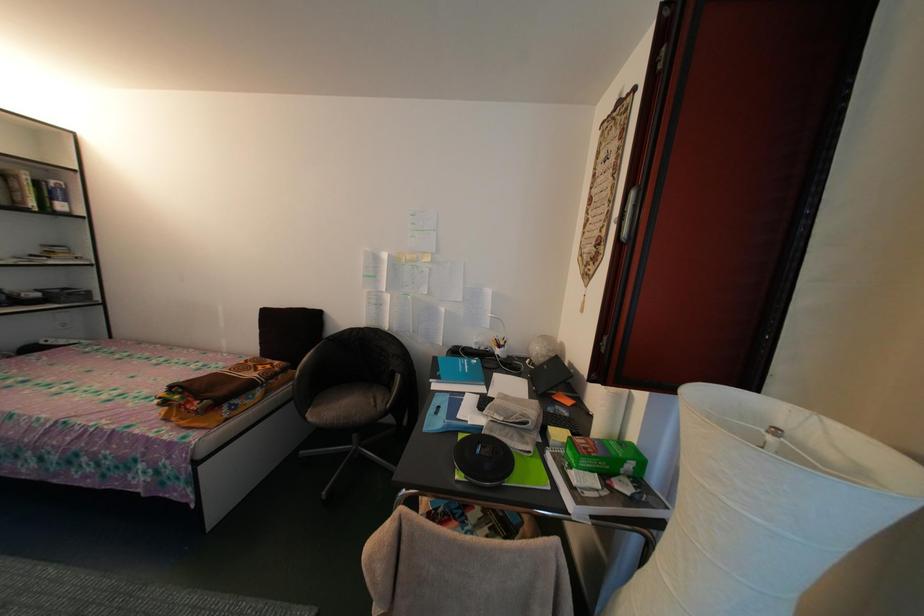
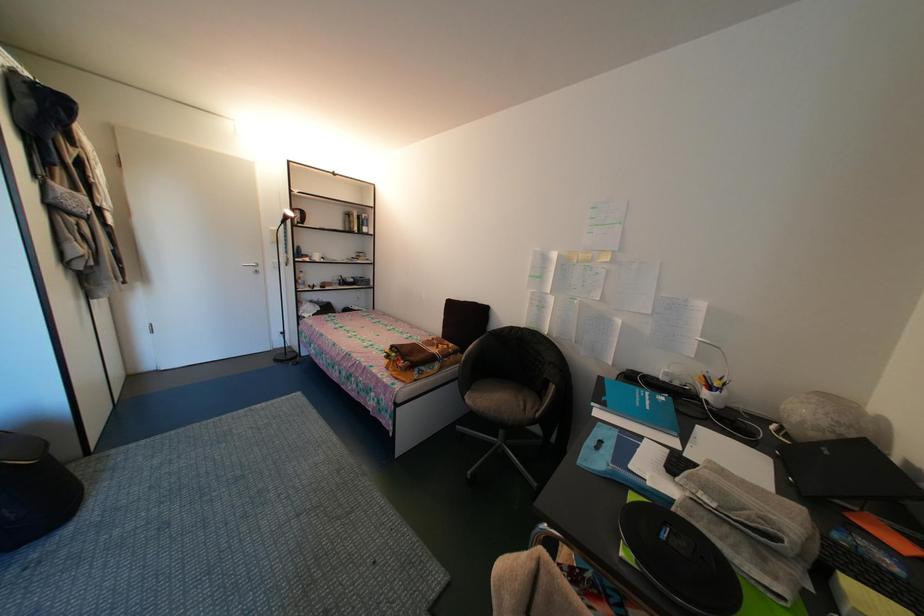
Question: The camera is either moving clockwise (left) or counter-clockwise (right) around the object. The first image is from the beginning of the video and the second image is from the end. Is the camera moving left or right when shooting the video?

Choices:
 (A) Left
 (B) Right

Answer: (B)